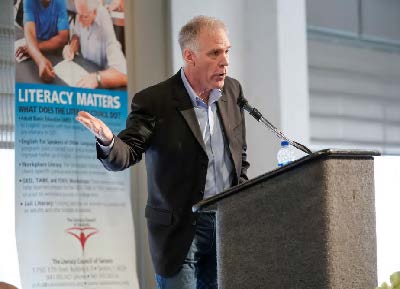
Image resolution: width=400 pixels, height=289 pixels. Identify the location of water bottle blue cap. (283, 143).